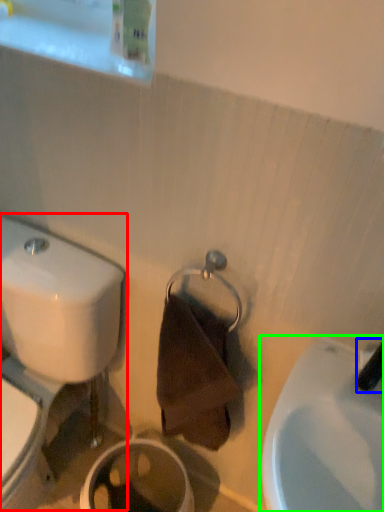
Question: Which object is positioned closest to toilet (highlighted by a red box)? Select from plumbing fixture (highlighted by a blue box) and sink (highlighted by a green box).

Choices:
 (A) plumbing fixture
 (B) sink

Answer: (B)